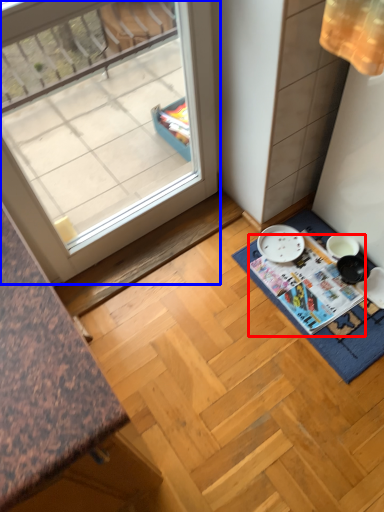
Question: Which of the following is the farthest to the observer, magazine (highlighted by a red box) or window (highlighted by a blue box)?

Choices:
 (A) magazine
 (B) window

Answer: (A)